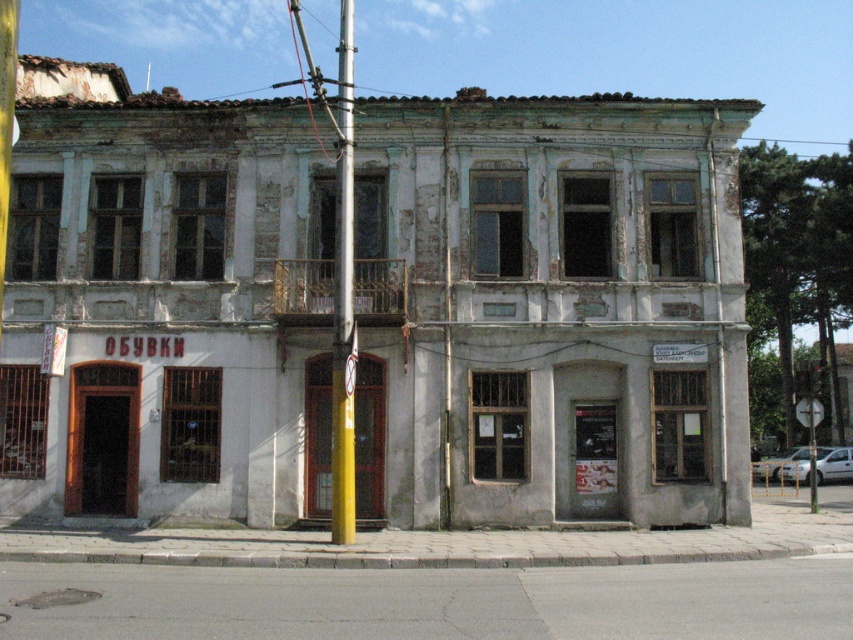
Is yellow painted metal pole at center wider than white plastic sign at upper right?

Correct, the width of yellow painted metal pole at center exceeds that of white plastic sign at upper right.

Is yellow painted metal pole at center closer to camera compared to white plastic sign at upper right?

Yes, yellow painted metal pole at center is closer to the viewer.

Between point (341, 49) and point (814, 483), which one is positioned in front?

Point (814, 483) is more forward.

Where is `yellow painted metal pole at center`? This screenshot has width=853, height=640. yellow painted metal pole at center is located at coordinates (343, 300).